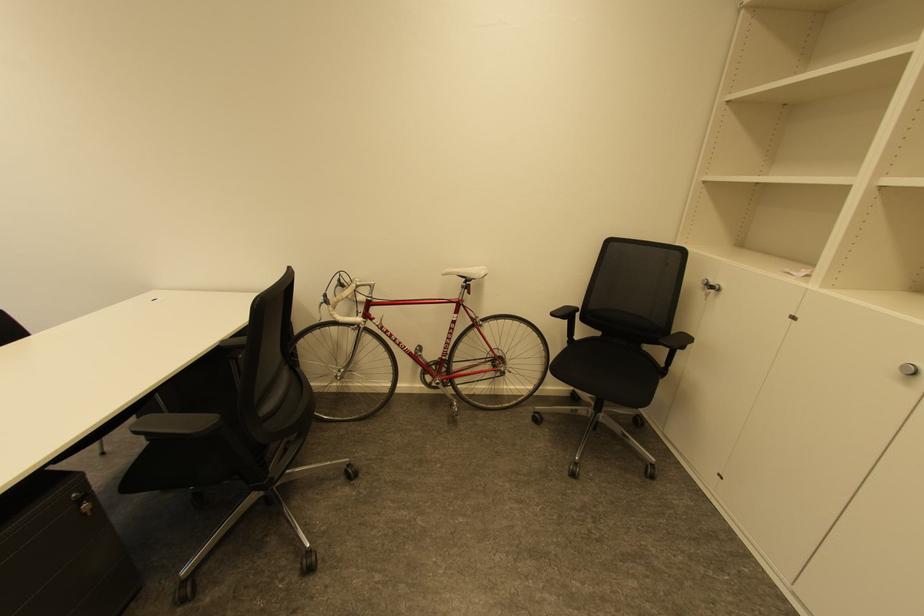
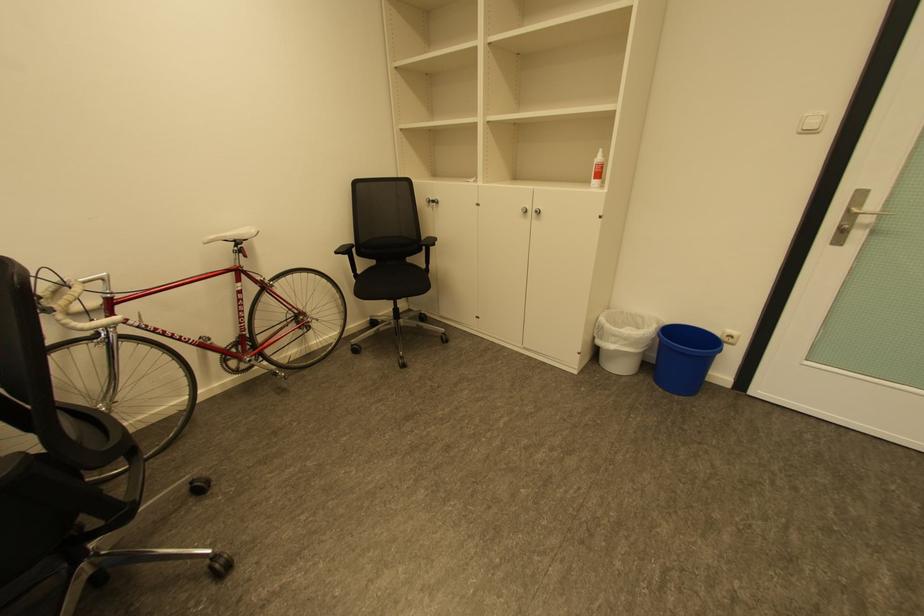
Find the pixel in the second image that matches (x=560, y=315) in the first image.

(344, 253)